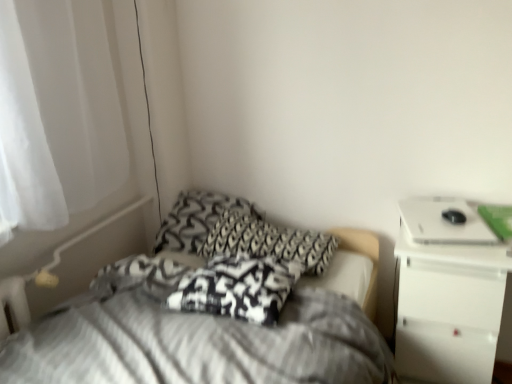
Question: Could you tell me if black and white patterned pillow at center, which is the second pillow from front to back, is facing white glossy nightstand at upper right?

Choices:
 (A) no
 (B) yes

Answer: (B)

Question: Considering the relative sizes of black and white patterned pillow at center, which is the second pillow from front to back, and white glossy nightstand at upper right in the image provided, is black and white patterned pillow at center, which is the second pillow from front to back, smaller than white glossy nightstand at upper right?

Choices:
 (A) no
 (B) yes

Answer: (B)

Question: Are black and white patterned pillow at center, which is the second pillow from front to back, and white glossy nightstand at upper right beside each other?

Choices:
 (A) yes
 (B) no

Answer: (B)

Question: From a real-world perspective, does black and white patterned pillow at center, which ranks as the 2th pillow in back-to-front order, stand above white glossy nightstand at upper right?

Choices:
 (A) no
 (B) yes

Answer: (B)

Question: Does black and white patterned pillow at center, which is the second pillow from front to back, appear on the left side of white glossy nightstand at upper right?

Choices:
 (A) yes
 (B) no

Answer: (A)

Question: Is black and white patterned pillow at center, which is the second pillow from front to back, wider than white glossy nightstand at upper right?

Choices:
 (A) no
 (B) yes

Answer: (B)

Question: Considering the relative sizes of black and white patterned pillow at center, the 1th pillow from the front, and white sheer curtain at left in the image provided, is black and white patterned pillow at center, the 1th pillow from the front, bigger than white sheer curtain at left?

Choices:
 (A) yes
 (B) no

Answer: (B)

Question: From a real-world perspective, is black and white patterned pillow at center, marked as the third pillow in a back-to-front arrangement, under white sheer curtain at left?

Choices:
 (A) no
 (B) yes

Answer: (B)

Question: Can you confirm if black and white patterned pillow at center, the 1th pillow from the front, is taller than white sheer curtain at left?

Choices:
 (A) yes
 (B) no

Answer: (B)

Question: Does black and white patterned pillow at center, marked as the third pillow in a back-to-front arrangement, have a greater width compared to white sheer curtain at left?

Choices:
 (A) no
 (B) yes

Answer: (B)

Question: From the image's perspective, would you say black and white patterned pillow at center, marked as the third pillow in a back-to-front arrangement, is positioned over white sheer curtain at left?

Choices:
 (A) no
 (B) yes

Answer: (A)

Question: Is white sheer curtain at left surrounded by black and white patterned pillow at center, marked as the third pillow in a back-to-front arrangement?

Choices:
 (A) yes
 (B) no

Answer: (B)

Question: Is white glossy laptop at upper right at the left side of white glossy nightstand at upper right?

Choices:
 (A) no
 (B) yes

Answer: (B)